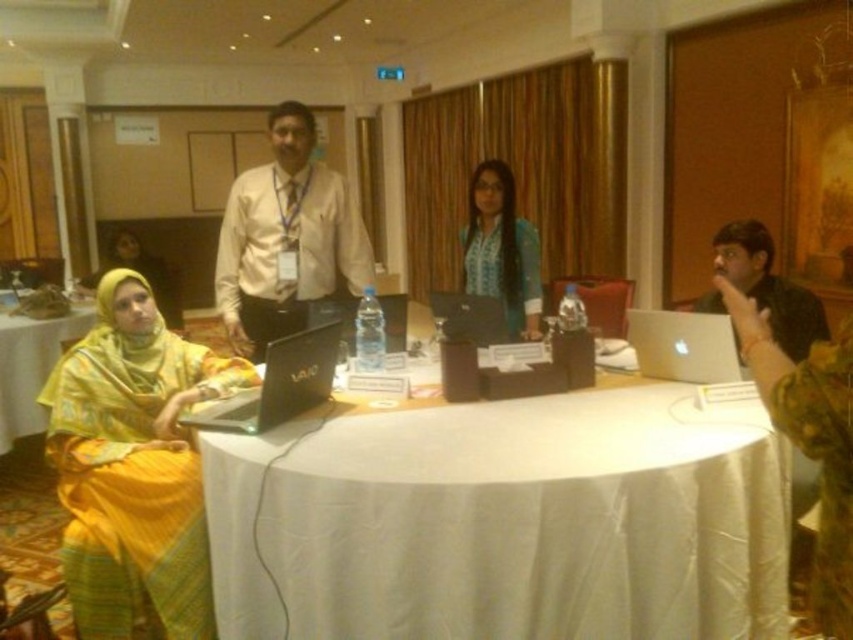
Is blue fabric shirt at center bigger than matte black laptop at lower left?

Indeed, blue fabric shirt at center has a larger size compared to matte black laptop at lower left.

Can you confirm if blue fabric shirt at center is positioned to the right of matte black laptop at lower left?

Indeed, blue fabric shirt at center is positioned on the right side of matte black laptop at lower left.

This screenshot has width=853, height=640. What do you see at coordinates (502, 250) in the screenshot? I see `blue fabric shirt at center` at bounding box center [502, 250].

Identify the location of blue fabric shirt at center. Image resolution: width=853 pixels, height=640 pixels. coord(502,250).

How much distance is there between blue fabric shirt at center and white cloth table at lower left?

blue fabric shirt at center and white cloth table at lower left are 7.58 feet apart.

Can you confirm if blue fabric shirt at center is smaller than white cloth table at lower left?

Indeed, blue fabric shirt at center has a smaller size compared to white cloth table at lower left.

This screenshot has height=640, width=853. Describe the element at coordinates (502, 250) in the screenshot. I see `blue fabric shirt at center` at that location.

The image size is (853, 640). I want to click on blue fabric shirt at center, so pyautogui.click(x=502, y=250).

From the picture: Between matte white shirt at center and black matte laptop at center, which one appears on the left side from the viewer's perspective?

Positioned to the left is matte white shirt at center.

Is point (349, 266) more distant than point (451, 312)?

Yes, it is behind point (451, 312).

What are the coordinates of `matte white shirt at center` in the screenshot? It's located at (286, 237).